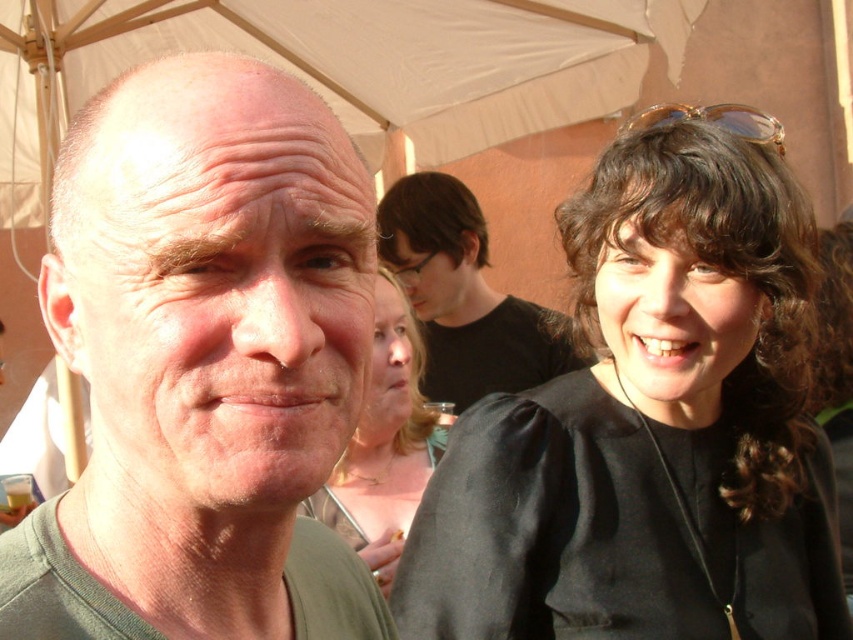
You are a photographer standing at the back of the tent. You want to take a photo of the black matte shirt at center while ensuring the white fabric canopy at upper center is also in the frame. Given the distance between them, is it possible to capture both subjects in a single shot without moving either?

The distance between the white fabric canopy at upper center and the black matte shirt at center is 74.52 centimeters. Since both subjects are within a reasonable proximity, it should be possible to capture both in a single shot without needing to move either subject.

You are a photographer at this outdoor gathering and want to capture a photo where both the black matte shirt at upper right and the black matte shirt at center are clearly visible. Which shirt should you focus on to ensure the other remains in the background?

The black matte shirt at upper right is smaller than the black matte shirt at center. To ensure both are visible, focus on the black matte shirt at center since it is larger and likely closer, keeping the smaller one at upper right in the background.

You are standing at the point marked by the coordinate point (340, 67) in the image. Looking around, you notice the white fabric canopy at upper center. What object is located at your current position?

The point (340, 67) indicates the location of the white fabric canopy at upper center.